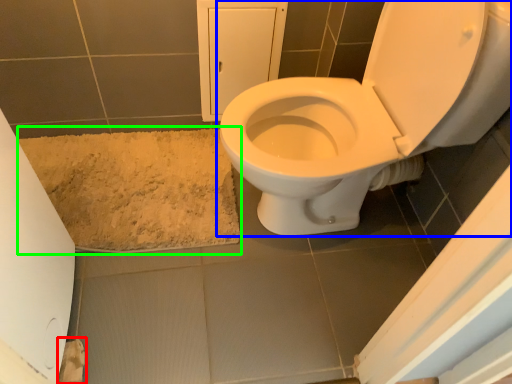
Question: Which object is positioned closest to toilet paper (highlighted by a red box)? Select from toilet (highlighted by a blue box) and bath mat (highlighted by a green box).

Choices:
 (A) toilet
 (B) bath mat

Answer: (B)